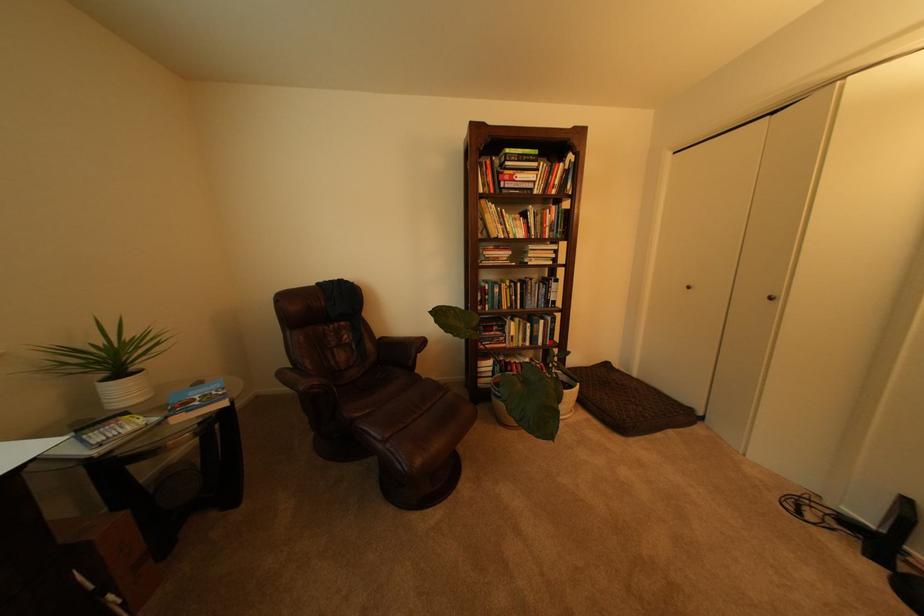
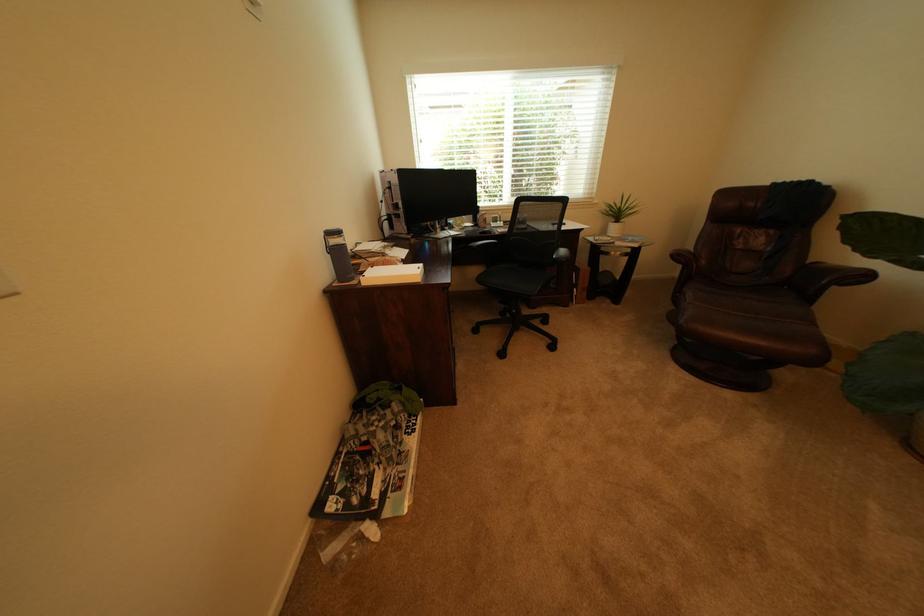
Locate, in the second image, the point that corresponds to the point at 388,339 in the first image.

(821, 262)